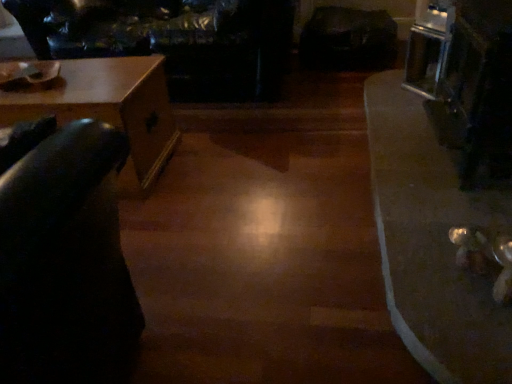
Where is `vacant space in between wooden table at left, which is the second table from right to left, and shiny metallic table at lower right, placed as the second table when sorted from left to right`? The height and width of the screenshot is (384, 512). vacant space in between wooden table at left, which is the second table from right to left, and shiny metallic table at lower right, placed as the second table when sorted from left to right is located at coordinates (270, 183).